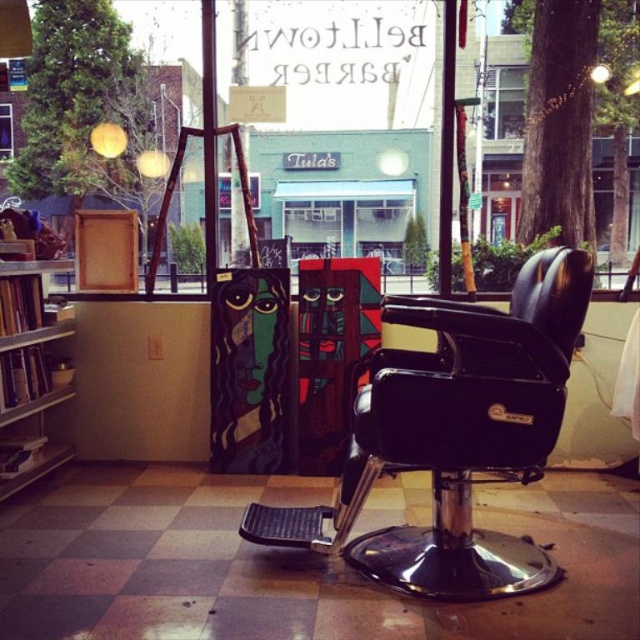
Question: Which point appears farthest from the camera in this image?

Choices:
 (A) (448, 595)
 (B) (61, 392)
 (C) (483, 134)

Answer: (C)

Question: Does black leather swivel chair at center have a greater width compared to clear glass window at upper center?

Choices:
 (A) yes
 (B) no

Answer: (A)

Question: Is clear glass window at upper center smaller than transparent glass window at upper left?

Choices:
 (A) no
 (B) yes

Answer: (A)

Question: Among these objects, which one is nearest to the camera?

Choices:
 (A) black leather swivel chair at center
 (B) clear glass window at upper center
 (C) wooden bookshelf at left

Answer: (A)

Question: Can you confirm if black leather swivel chair at center is positioned to the left of clear glass window at upper center?

Choices:
 (A) no
 (B) yes

Answer: (B)

Question: Considering the real-world distances, which object is closest to the transparent glass window at upper left?

Choices:
 (A) clear glass window at upper center
 (B) wooden bookshelf at left

Answer: (B)